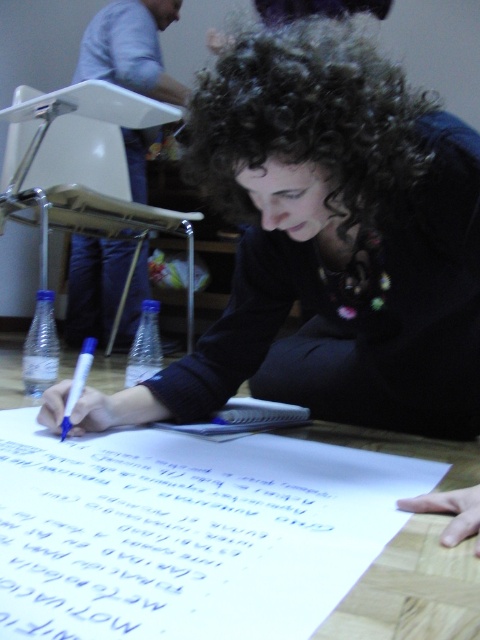
Which is below, clear plastic bottle at lower left or clear plastic bottle at center?

clear plastic bottle at center is lower down.

Does clear plastic bottle at lower left have a greater height compared to clear plastic bottle at center?

Yes, clear plastic bottle at lower left is taller than clear plastic bottle at center.

At what (x,y) coordinates should I click in order to perform the action: click on clear plastic bottle at lower left. Please return your answer as a coordinate pair (x, y). This screenshot has width=480, height=640. Looking at the image, I should click on (40, 348).

Looking at this image, is clear plastic bottle at lower left smaller than blue marker at lower left?

Actually, clear plastic bottle at lower left might be larger than blue marker at lower left.

Between clear plastic bottle at lower left and blue marker at lower left, which one appears on the left side from the viewer's perspective?

clear plastic bottle at lower left

Measure the distance between clear plastic bottle at lower left and camera.

A distance of 1.52 meters exists between clear plastic bottle at lower left and camera.

Find the location of `clear plastic bottle at lower left`. clear plastic bottle at lower left is located at coordinates (40, 348).

Who is taller, wooden table at lower center or blue marker at lower left?

With more height is blue marker at lower left.

Does wooden table at lower center have a lesser width compared to blue marker at lower left?

No, wooden table at lower center is not thinner than blue marker at lower left.

Is point (348, 625) more distant than point (86, 344)?

No, (348, 625) is in front of (86, 344).

The image size is (480, 640). I want to click on wooden table at lower center, so click(x=414, y=589).